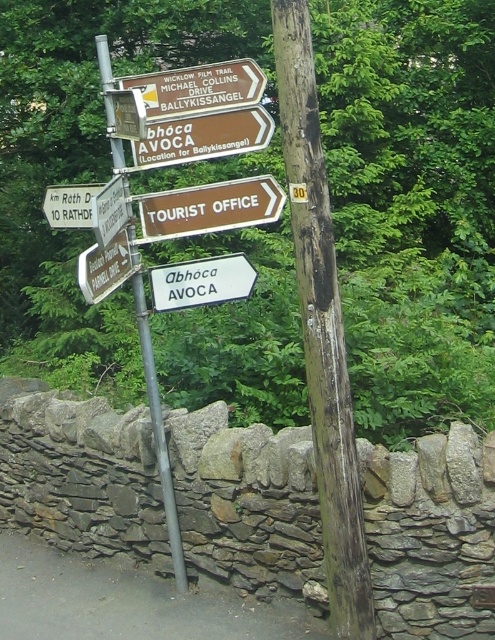
Between brown wooden sign at upper center and white plastic sign at center, which one has less height?

white plastic sign at center

Locate an element on the screen. The height and width of the screenshot is (640, 495). brown wooden sign at upper center is located at coordinates (203, 138).

Where is `brown wooden sign at upper center`? brown wooden sign at upper center is located at coordinates (203, 138).

Who is more distant from viewer, [142,77] or [119,163]?

The point [119,163] is behind.

Does brown wooden signpost at upper center lie in front of metallic pole at upper center?

Yes, brown wooden signpost at upper center is closer to the viewer.

Locate an element on the screen. The height and width of the screenshot is (640, 495). brown wooden signpost at upper center is located at coordinates (198, 88).

Image resolution: width=495 pixels, height=640 pixels. Find the location of `brown wooden signpost at upper center`. brown wooden signpost at upper center is located at coordinates (198, 88).

You are a GUI agent. You are given a task and a screenshot of the screen. Output one action in this format:
    pyautogui.click(x=<x>, y=<y>)
    Task: Click on the white plastic sign at center
    
    Given the screenshot: What is the action you would take?
    pyautogui.click(x=200, y=282)

Which is behind, point (207, 259) or point (82, 202)?

The point (82, 202) is more distant.

Where is `white plastic sign at center`? The height and width of the screenshot is (640, 495). white plastic sign at center is located at coordinates (200, 282).